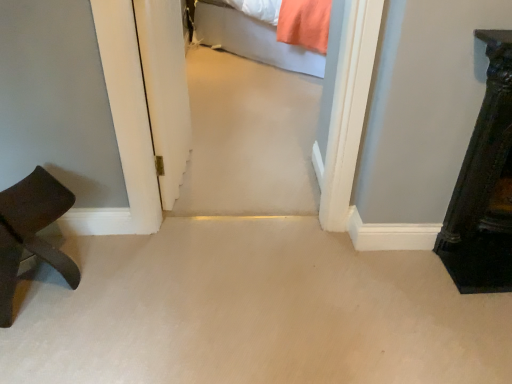
Question: Is light gray fabric bed at upper center taller than dark wood dresser at right, the 2th furniture viewed from the left?

Choices:
 (A) yes
 (B) no

Answer: (B)

Question: Does light gray fabric bed at upper center have a smaller size compared to dark wood dresser at right, the 2th furniture viewed from the left?

Choices:
 (A) no
 (B) yes

Answer: (A)

Question: Does light gray fabric bed at upper center appear on the left side of dark wood dresser at right, the 2th furniture viewed from the left?

Choices:
 (A) no
 (B) yes

Answer: (B)

Question: Is light gray fabric bed at upper center aimed at dark wood dresser at right, the 2th furniture viewed from the left?

Choices:
 (A) yes
 (B) no

Answer: (B)

Question: Is light gray fabric bed at upper center oriented away from dark wood dresser at right, positioned as the first furniture in right-to-left order?

Choices:
 (A) no
 (B) yes

Answer: (A)

Question: Is there a large distance between light gray fabric bed at upper center and dark wood dresser at right, positioned as the first furniture in right-to-left order?

Choices:
 (A) yes
 (B) no

Answer: (A)

Question: Considering the relative sizes of transparent glass door at center and light gray fabric bed at upper center in the image provided, is transparent glass door at center thinner than light gray fabric bed at upper center?

Choices:
 (A) no
 (B) yes

Answer: (B)

Question: Is light gray fabric bed at upper center a part of transparent glass door at center?

Choices:
 (A) no
 (B) yes

Answer: (A)

Question: From a real-world perspective, is transparent glass door at center below light gray fabric bed at upper center?

Choices:
 (A) yes
 (B) no

Answer: (B)

Question: Can you see transparent glass door at center touching light gray fabric bed at upper center?

Choices:
 (A) yes
 (B) no

Answer: (B)

Question: From a real-world perspective, is transparent glass door at center located higher than light gray fabric bed at upper center?

Choices:
 (A) yes
 (B) no

Answer: (A)

Question: Is transparent glass door at center positioned with its back to light gray fabric bed at upper center?

Choices:
 (A) no
 (B) yes

Answer: (A)

Question: Does dark wood dresser at right, positioned as the first furniture in right-to-left order, have a larger size compared to transparent glass door at center?

Choices:
 (A) yes
 (B) no

Answer: (B)